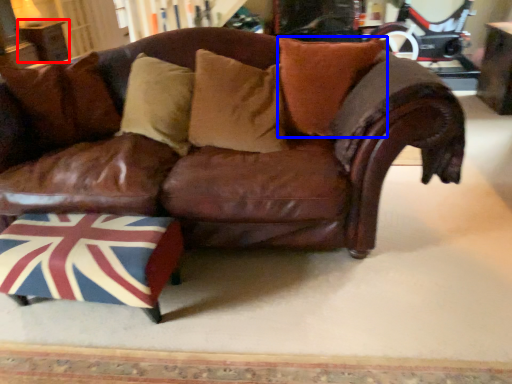
Question: Which point is closer to the camera, table (highlighted by a red box) or pillow (highlighted by a blue box)?

Choices:
 (A) table
 (B) pillow

Answer: (B)